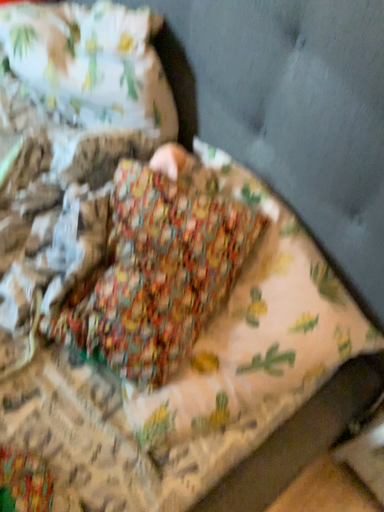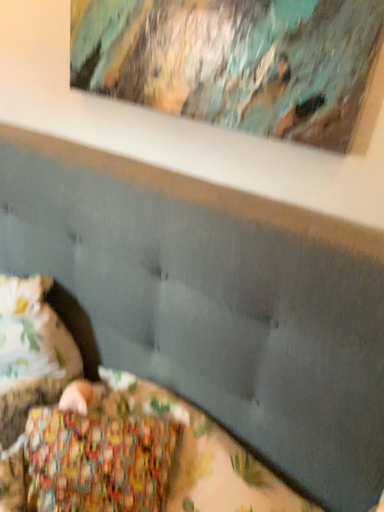
Question: Which way did the camera rotate in the video?

Choices:
 (A) rotated downward
 (B) rotated upward

Answer: (B)